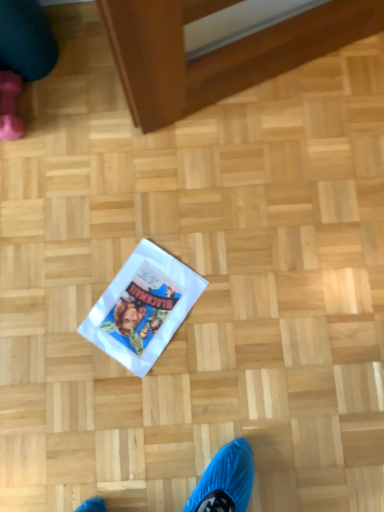
Where is `free area in between teal fabric leg at upper left and white paper flyer at center`? This screenshot has height=512, width=384. free area in between teal fabric leg at upper left and white paper flyer at center is located at coordinates (97, 184).